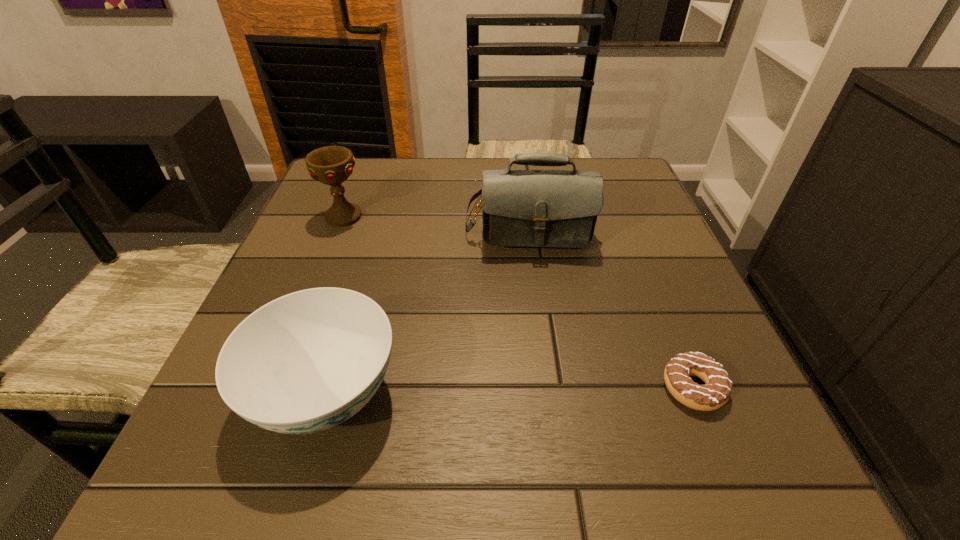
What are the coordinates of `shoulder bag that is at the far edge` in the screenshot? It's located at (520, 208).

Locate an element on the screen. Image resolution: width=960 pixels, height=540 pixels. chalice located in the far edge section of the desktop is located at coordinates (331, 165).

Where is `object that is positioned at the near edge`? object that is positioned at the near edge is located at coordinates (305, 362).

This screenshot has height=540, width=960. In order to click on chalice that is positioned at the left edge in this screenshot , I will do `click(331, 165)`.

The width and height of the screenshot is (960, 540). Find the location of `chinaware at the left edge`. chinaware at the left edge is located at coordinates (305, 362).

Find the location of a particular element. The height and width of the screenshot is (540, 960). shoulder bag that is at the right edge is located at coordinates (520, 208).

Where is `doughnut that is at the right edge`? doughnut that is at the right edge is located at coordinates (716, 392).

Identify the location of object positioned at the far left corner. (331, 165).

The height and width of the screenshot is (540, 960). I want to click on object present at the near left corner, so click(305, 362).

At what (x,y) coordinates should I click in order to perform the action: click on object positioned at the far right corner. Please return your answer as a coordinate pair (x, y). Looking at the image, I should click on (520, 208).